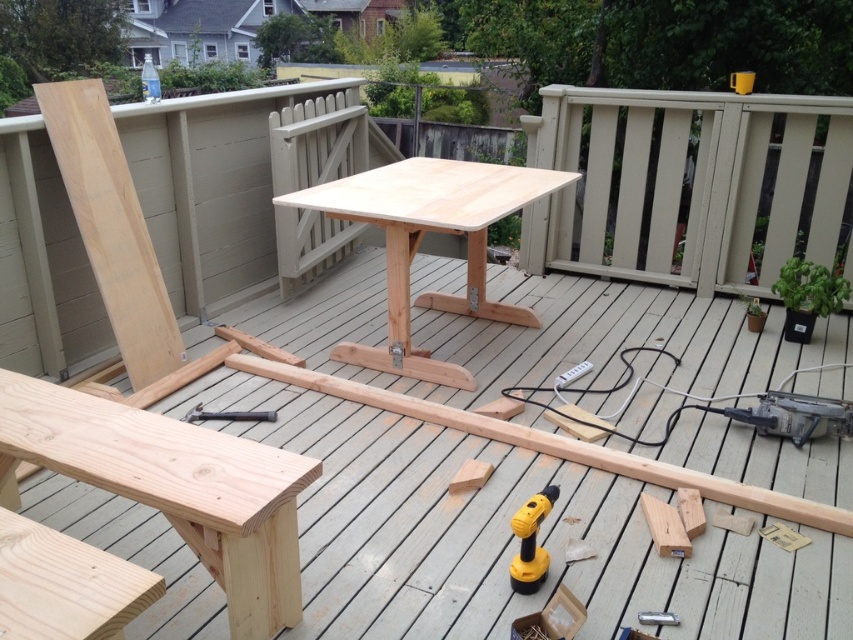
Who is more forward, [485,221] or [184,413]?

Point [485,221] is in front.

Does natural wood table at center have a larger size compared to silver metallic hammer at center?

Yes, natural wood table at center is bigger than silver metallic hammer at center.

Where is `natural wood table at center`? The height and width of the screenshot is (640, 853). natural wood table at center is located at coordinates (421, 240).

Does yellow plastic drill at lower center have a lesser height compared to silver metallic hammer at center?

No, yellow plastic drill at lower center is not shorter than silver metallic hammer at center.

Which is in front, point (523, 552) or point (260, 416)?

Point (523, 552)

Identify the location of yellow plastic drill at lower center. The height and width of the screenshot is (640, 853). (531, 541).

The image size is (853, 640). What do you see at coordinates (177, 486) in the screenshot? I see `natural wood bench at lower left` at bounding box center [177, 486].

Can you confirm if natural wood bench at lower left is positioned above natural wood table at center?

No, natural wood bench at lower left is not above natural wood table at center.

Locate an element on the screen. Image resolution: width=853 pixels, height=640 pixels. natural wood bench at lower left is located at coordinates (177, 486).